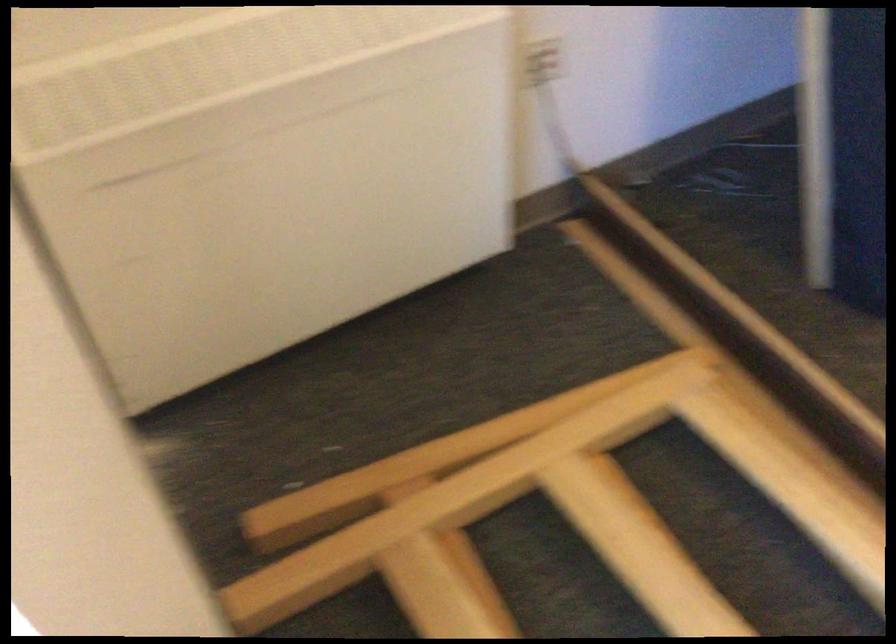
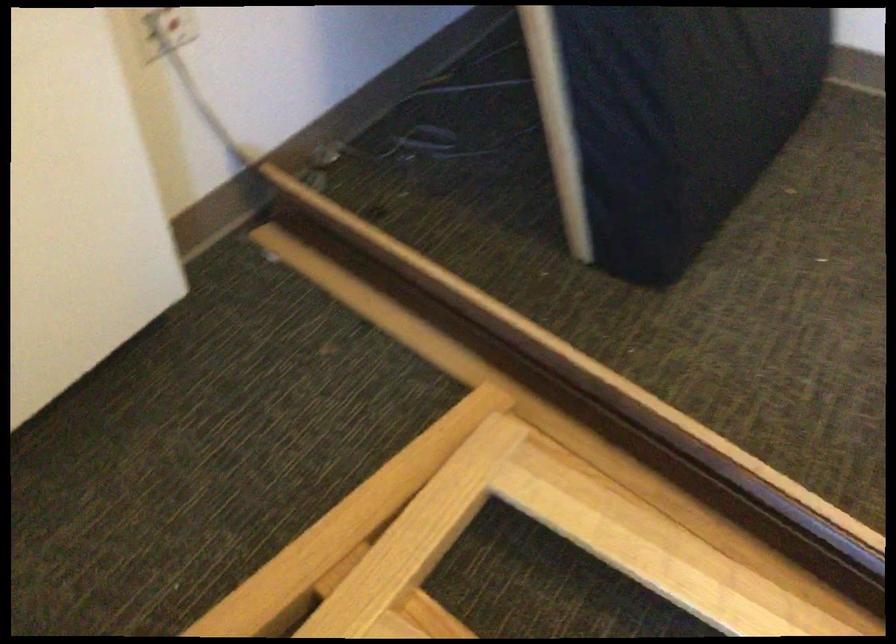
Question: Based on the continuous images, in which direction is the camera rotating? Reply with the corresponding letter.

Choices:
 (A) Left
 (B) Right
 (C) Up
 (D) Down

Answer: (B)